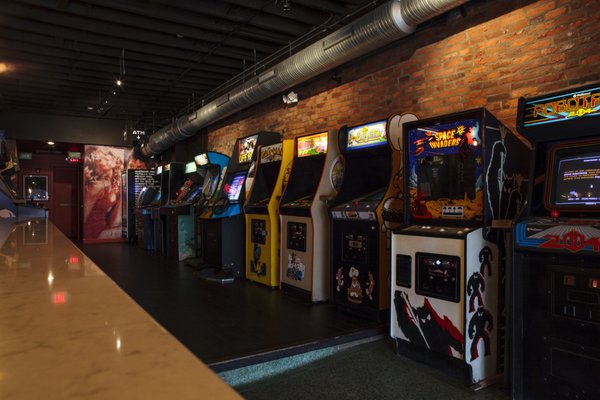
Locate an element on the screen. Image resolution: width=600 pixels, height=400 pixels. vent is located at coordinates (297, 65).